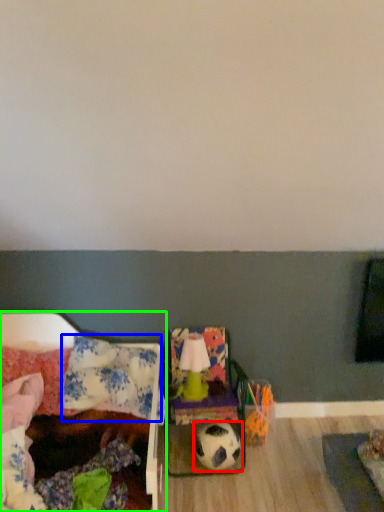
Question: Considering the real-world distances, which object is closest to football (highlighted by a red box)? pillow (highlighted by a blue box) or furniture (highlighted by a green box).

Choices:
 (A) pillow
 (B) furniture

Answer: (B)